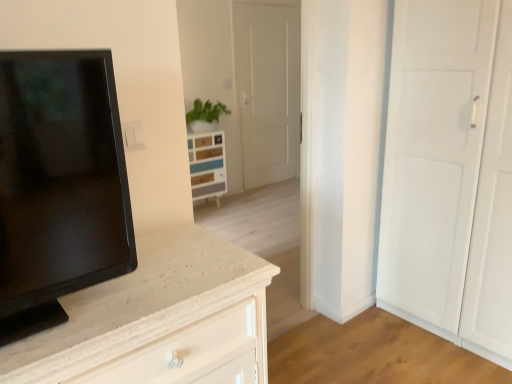
Question: Considering the relative positions of wooden chest of drawers at center and black glossy tv at left in the image provided, is wooden chest of drawers at center to the left or to the right of black glossy tv at left?

Choices:
 (A) left
 (B) right

Answer: (A)

Question: In terms of height, does wooden chest of drawers at center look taller or shorter compared to black glossy tv at left?

Choices:
 (A) short
 (B) tall

Answer: (B)

Question: Considering the positions of point (220, 173) and point (39, 188), is point (220, 173) closer or farther from the camera than point (39, 188)?

Choices:
 (A) farther
 (B) closer

Answer: (A)

Question: Is black glossy tv at left bigger or smaller than wooden chest of drawers at center?

Choices:
 (A) small
 (B) big

Answer: (A)

Question: Would you say black glossy tv at left is to the left or to the right of wooden chest of drawers at center in the picture?

Choices:
 (A) left
 (B) right

Answer: (B)

Question: From a real-world perspective, is black glossy tv at left above or below wooden chest of drawers at center?

Choices:
 (A) above
 (B) below

Answer: (A)

Question: Does point (10, 89) appear closer or farther from the camera than point (218, 140)?

Choices:
 (A) closer
 (B) farther

Answer: (A)